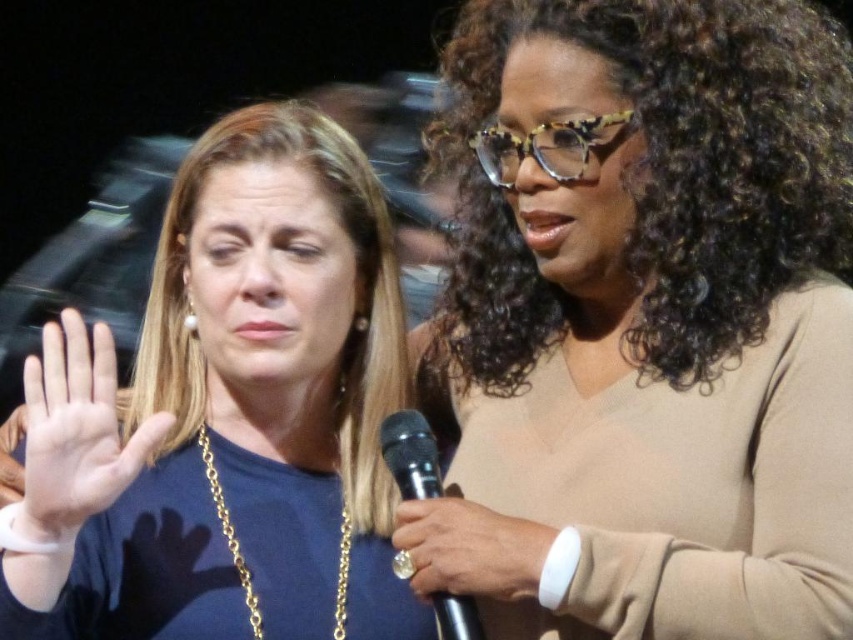
You are a photographer adjusting the camera focus. You need to ensure both the brown matte sweater at upper right and the blue fabric shirt at left are in focus. Which object should you adjust the focus to prioritize first to account for their sizes?

The brown matte sweater at upper right is taller than the blue fabric shirt at left, so you should prioritize focusing on the brown matte sweater at upper right first since it is larger and requires more precise focus to ensure clarity.

You are a photographer standing 5 feet away from the scene. You want to take a closeup photo of the white leather wristband at upper right without moving your position. Is the wristband within your camera lens focus range if the minimum focus distance is 3 feet?

The white leather wristband at upper right is 4.02 feet away from the viewer. Since the minimum focus distance is 3 feet, the camera can focus on the wristband as it is within the required range.